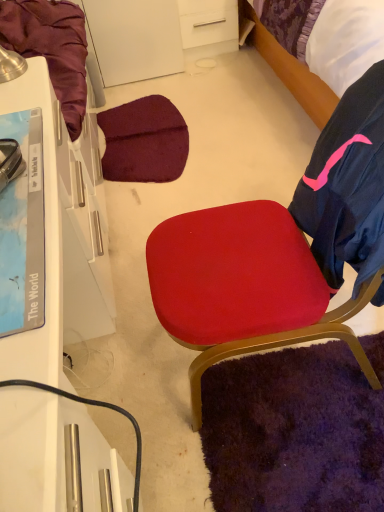
Question: From a real-world perspective, is white glossy desk at left under matte red cushion at center?

Choices:
 (A) yes
 (B) no

Answer: (A)

Question: Can you confirm if white glossy desk at left is thinner than matte red cushion at center?

Choices:
 (A) yes
 (B) no

Answer: (A)

Question: From the image's perspective, is white glossy desk at left below matte red cushion at center?

Choices:
 (A) yes
 (B) no

Answer: (A)

Question: Does white glossy desk at left have a lesser height compared to matte red cushion at center?

Choices:
 (A) no
 (B) yes

Answer: (B)

Question: Is white glossy desk at left outside of matte red cushion at center?

Choices:
 (A) yes
 (B) no

Answer: (A)

Question: Is matte red cushion at center to the left or to the right of purple fabric bed at upper right in the image?

Choices:
 (A) right
 (B) left

Answer: (B)

Question: Which is correct: matte red cushion at center is inside purple fabric bed at upper right, or outside of it?

Choices:
 (A) outside
 (B) inside

Answer: (A)

Question: From a real-world perspective, is matte red cushion at center positioned above or below purple fabric bed at upper right?

Choices:
 (A) below
 (B) above

Answer: (B)

Question: Considering the positions of matte red cushion at center and purple fabric bed at upper right in the image, is matte red cushion at center bigger or smaller than purple fabric bed at upper right?

Choices:
 (A) small
 (B) big

Answer: (A)

Question: In terms of height, does matte red cushion at center look taller or shorter compared to white glossy desk at left?

Choices:
 (A) tall
 (B) short

Answer: (A)

Question: Which is correct: matte red cushion at center is inside white glossy desk at left, or outside of it?

Choices:
 (A) outside
 (B) inside

Answer: (A)

Question: Based on their positions, is matte red cushion at center located to the left or right of white glossy desk at left?

Choices:
 (A) right
 (B) left

Answer: (A)

Question: Considering the positions of matte red cushion at center and white glossy desk at left in the image, is matte red cushion at center wider or thinner than white glossy desk at left?

Choices:
 (A) thin
 (B) wide

Answer: (B)

Question: Is point (251, 10) closer or farther from the camera than point (3, 328)?

Choices:
 (A) closer
 (B) farther

Answer: (B)

Question: Relative to white glossy desk at left, is purple fabric bed at upper right in front or behind?

Choices:
 (A) front
 (B) behind

Answer: (B)